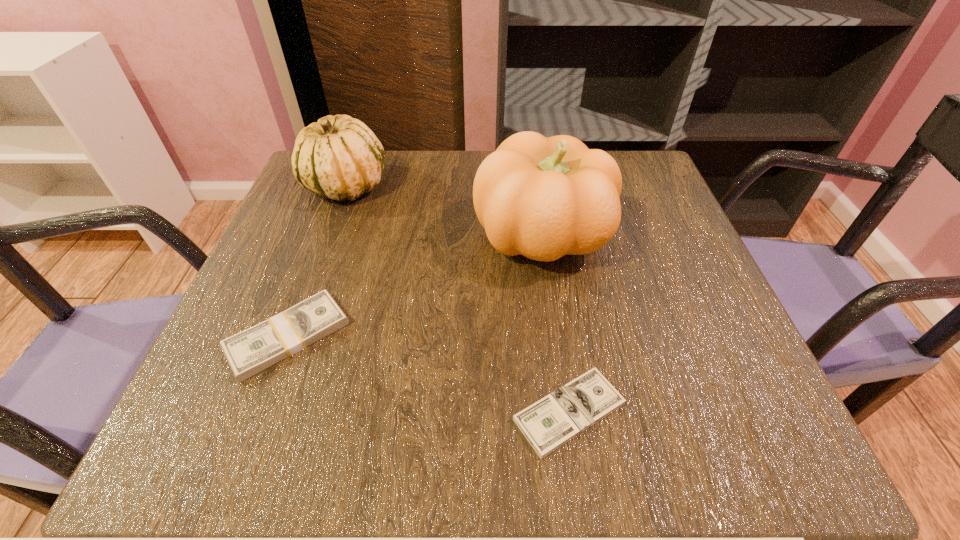
At what (x,y) coordinates should I click in order to perform the action: click on pumpkin that is at the far edge. Please return your answer as a coordinate pair (x, y). The image size is (960, 540). Looking at the image, I should click on (543, 198).

What are the coordinates of `gourd located in the far edge section of the desktop` in the screenshot? It's located at (338, 157).

The image size is (960, 540). Find the location of `object situated at the near edge`. object situated at the near edge is located at coordinates (552, 421).

Find the location of a particular element. gourd that is positioned at the left edge is located at coordinates (338, 157).

Where is `dollar that is at the left edge`? dollar that is at the left edge is located at coordinates (253, 350).

Find the location of a particular element. object that is at the right edge is located at coordinates coord(543,198).

Where is `object at the far left corner`? The image size is (960, 540). object at the far left corner is located at coordinates (338, 157).

The height and width of the screenshot is (540, 960). Identify the location of object that is at the far right corner. (543, 198).

Locate an element on the screen. vacant space at the far edge of the desktop is located at coordinates (458, 174).

Where is `free spot at the near edge of the desktop`? The height and width of the screenshot is (540, 960). free spot at the near edge of the desktop is located at coordinates (534, 450).